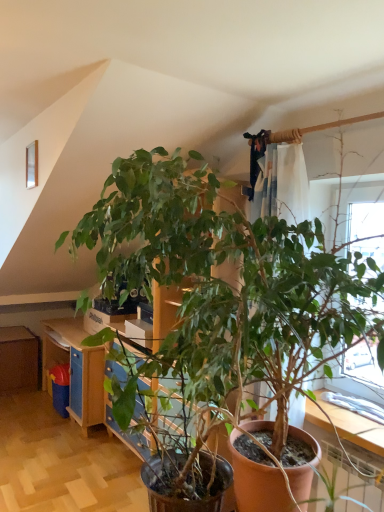
How much space does blue painted wood dresser at center, positioned as the 1th dresser in front-to-back order, occupy vertically?

It is 37.00 inches.

This screenshot has height=512, width=384. Find the location of `blue painted wood dresser at center, which is the first dresser in right-to-left order`. blue painted wood dresser at center, which is the first dresser in right-to-left order is located at coordinates (69, 330).

Image resolution: width=384 pixels, height=512 pixels. Describe the element at coordinates (69, 330) in the screenshot. I see `blue painted wood dresser at center, which is the 2th dresser in back-to-front order` at that location.

Measure the distance between brown wooden dresser at left, placed as the 2th dresser when sorted from right to left, and camera.

They are 4.11 meters apart.

The height and width of the screenshot is (512, 384). What do you see at coordinates (18, 359) in the screenshot? I see `brown wooden dresser at left, which appears as the first dresser when viewed from the left` at bounding box center [18, 359].

The height and width of the screenshot is (512, 384). Find the location of `brown wooden dresser at left, placed as the 2th dresser when sorted from right to left`. brown wooden dresser at left, placed as the 2th dresser when sorted from right to left is located at coordinates (18, 359).

Where is `blue painted wood dresser at center, which is the 2th dresser in back-to-front order`? blue painted wood dresser at center, which is the 2th dresser in back-to-front order is located at coordinates (69, 330).

Considering the relative positions of blue painted wood dresser at center, the 2th dresser in the left-to-right sequence, and brown wooden dresser at left, placed as the 2th dresser when sorted from right to left, in the image provided, is blue painted wood dresser at center, the 2th dresser in the left-to-right sequence, to the left of brown wooden dresser at left, placed as the 2th dresser when sorted from right to left, from the viewer's perspective?

Incorrect, blue painted wood dresser at center, the 2th dresser in the left-to-right sequence, is not on the left side of brown wooden dresser at left, placed as the 2th dresser when sorted from right to left.

In the scene shown: Which object is further away from the camera, blue painted wood dresser at center, the 2th dresser in the left-to-right sequence, or brown wooden dresser at left, which appears as the 1th dresser when viewed from the back?

brown wooden dresser at left, which appears as the 1th dresser when viewed from the back, is more distant.

Which point is more distant from viewer, (44, 321) or (20, 334)?

Point (44, 321)

From the image's perspective, is blue painted wood dresser at center, the 2th dresser in the left-to-right sequence, above or below brown wooden dresser at left, placed as the 2th dresser when sorted from right to left?

blue painted wood dresser at center, the 2th dresser in the left-to-right sequence, is situated higher than brown wooden dresser at left, placed as the 2th dresser when sorted from right to left, in the image.

From a real-world perspective, relative to brown wooden dresser at left, which appears as the first dresser when viewed from the left, is blue painted wood dresser at center, the 2th dresser in the left-to-right sequence, vertically above or below?

blue painted wood dresser at center, the 2th dresser in the left-to-right sequence, is situated higher than brown wooden dresser at left, which appears as the first dresser when viewed from the left, in the real world.

Does blue painted wood dresser at center, the 2th dresser in the left-to-right sequence, have a lesser width compared to brown wooden dresser at left, marked as the second dresser in a front-to-back arrangement?

Yes.

Who is taller, blue painted wood dresser at center, which is the first dresser in right-to-left order, or brown wooden dresser at left, which appears as the 1th dresser when viewed from the back?

blue painted wood dresser at center, which is the first dresser in right-to-left order.

In terms of size, does blue painted wood dresser at center, which is the first dresser in right-to-left order, appear bigger or smaller than brown wooden dresser at left, which appears as the first dresser when viewed from the left?

In the image, blue painted wood dresser at center, which is the first dresser in right-to-left order, appears to be larger than brown wooden dresser at left, which appears as the first dresser when viewed from the left.

Can we say blue painted wood dresser at center, which is the 2th dresser in back-to-front order, lies outside brown wooden dresser at left, which appears as the 1th dresser when viewed from the back?

blue painted wood dresser at center, which is the 2th dresser in back-to-front order, is positioned outside brown wooden dresser at left, which appears as the 1th dresser when viewed from the back.

Is blue painted wood dresser at center, which is the first dresser in right-to-left order, next to brown wooden dresser at left, which appears as the first dresser when viewed from the left, and touching it?

blue painted wood dresser at center, which is the first dresser in right-to-left order, is not next to brown wooden dresser at left, which appears as the first dresser when viewed from the left, and they're not touching.

Is blue painted wood dresser at center, positioned as the 1th dresser in front-to-back order, positioned with its back to brown wooden dresser at left, which appears as the first dresser when viewed from the left?

That's not correct — blue painted wood dresser at center, positioned as the 1th dresser in front-to-back order, is not looking away from brown wooden dresser at left, which appears as the first dresser when viewed from the left.

In the scene shown: What's the angular difference between blue painted wood dresser at center, which is the 2th dresser in back-to-front order, and brown wooden dresser at left, marked as the second dresser in a front-to-back arrangement,'s facing directions?

The angle between the facing direction of blue painted wood dresser at center, which is the 2th dresser in back-to-front order, and the facing direction of brown wooden dresser at left, marked as the second dresser in a front-to-back arrangement, is 90 degrees.

In the scene shown: Measure the distance between blue painted wood dresser at center, positioned as the 1th dresser in front-to-back order, and brown wooden dresser at left, placed as the 2th dresser when sorted from right to left.

blue painted wood dresser at center, positioned as the 1th dresser in front-to-back order, and brown wooden dresser at left, placed as the 2th dresser when sorted from right to left, are 19.66 inches apart from each other.

Where is `dresser above the brown wooden dresser at left, which appears as the 1th dresser when viewed from the back (from a real-world perspective)`? dresser above the brown wooden dresser at left, which appears as the 1th dresser when viewed from the back (from a real-world perspective) is located at coordinates (69, 330).

Based on the photo, which object is positioned more to the left, brown wooden dresser at left, marked as the second dresser in a front-to-back arrangement, or blue painted wood dresser at center, which is the first dresser in right-to-left order?

From the viewer's perspective, brown wooden dresser at left, marked as the second dresser in a front-to-back arrangement, appears more on the left side.

Looking at this image, which object is more forward, brown wooden dresser at left, which appears as the 1th dresser when viewed from the back, or blue painted wood dresser at center, which is the first dresser in right-to-left order?

blue painted wood dresser at center, which is the first dresser in right-to-left order, is closer to the camera.

Which point is more distant from viewer, (18, 359) or (56, 319)?

Positioned behind is point (56, 319).

From the image's perspective, is brown wooden dresser at left, marked as the second dresser in a front-to-back arrangement, located above or below blue painted wood dresser at center, which is the 2th dresser in back-to-front order?

brown wooden dresser at left, marked as the second dresser in a front-to-back arrangement, is below blue painted wood dresser at center, which is the 2th dresser in back-to-front order.

Based on the photo, from a real-world perspective, which is physically above, brown wooden dresser at left, which appears as the first dresser when viewed from the left, or blue painted wood dresser at center, which is the first dresser in right-to-left order?

blue painted wood dresser at center, which is the first dresser in right-to-left order, from a real-world perspective.

Does brown wooden dresser at left, which appears as the 1th dresser when viewed from the back, have a lesser width compared to blue painted wood dresser at center, which is the 2th dresser in back-to-front order?

No, brown wooden dresser at left, which appears as the 1th dresser when viewed from the back, is not thinner than blue painted wood dresser at center, which is the 2th dresser in back-to-front order.

Does brown wooden dresser at left, marked as the second dresser in a front-to-back arrangement, have a lesser height compared to blue painted wood dresser at center, positioned as the 1th dresser in front-to-back order?

Yes, brown wooden dresser at left, marked as the second dresser in a front-to-back arrangement, is shorter than blue painted wood dresser at center, positioned as the 1th dresser in front-to-back order.

Considering the sizes of objects brown wooden dresser at left, placed as the 2th dresser when sorted from right to left, and blue painted wood dresser at center, positioned as the 1th dresser in front-to-back order, in the image provided, who is bigger, brown wooden dresser at left, placed as the 2th dresser when sorted from right to left, or blue painted wood dresser at center, positioned as the 1th dresser in front-to-back order,?

With larger size is blue painted wood dresser at center, positioned as the 1th dresser in front-to-back order.

Is brown wooden dresser at left, placed as the 2th dresser when sorted from right to left, located outside blue painted wood dresser at center, positioned as the 1th dresser in front-to-back order?

Yes, brown wooden dresser at left, placed as the 2th dresser when sorted from right to left, is outside of blue painted wood dresser at center, positioned as the 1th dresser in front-to-back order.

Is brown wooden dresser at left, which appears as the 1th dresser when viewed from the back, placed right next to blue painted wood dresser at center, which is the 2th dresser in back-to-front order?

No, brown wooden dresser at left, which appears as the 1th dresser when viewed from the back, is not in contact with blue painted wood dresser at center, which is the 2th dresser in back-to-front order.

Is brown wooden dresser at left, marked as the second dresser in a front-to-back arrangement, turned away from blue painted wood dresser at center, positioned as the 1th dresser in front-to-back order?

brown wooden dresser at left, marked as the second dresser in a front-to-back arrangement, does not have its back to blue painted wood dresser at center, positioned as the 1th dresser in front-to-back order.

Identify the location of dresser in front of the brown wooden dresser at left, placed as the 2th dresser when sorted from right to left. (69, 330).

Where is `dresser that appears below the blue painted wood dresser at center, which is the first dresser in right-to-left order (from a real-world perspective)`? dresser that appears below the blue painted wood dresser at center, which is the first dresser in right-to-left order (from a real-world perspective) is located at coordinates (18, 359).

Image resolution: width=384 pixels, height=512 pixels. I want to click on dresser in front of the brown wooden dresser at left, placed as the 2th dresser when sorted from right to left, so click(x=69, y=330).